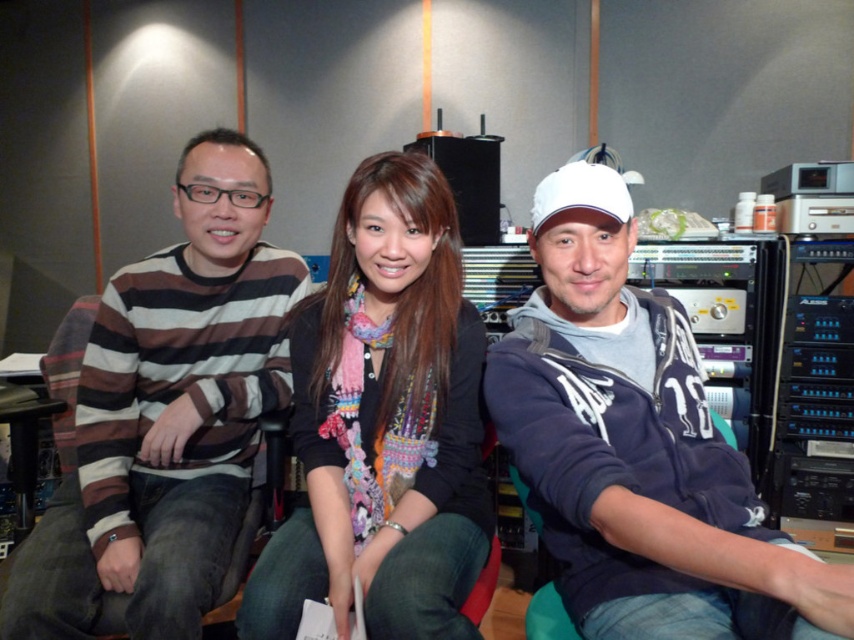
Does white matte baseball cap at upper right have a greater height compared to multicolored knitted scarf at center?

No.

Is the position of white matte baseball cap at upper right more distant than that of multicolored knitted scarf at center?

No, it is not.

This screenshot has width=854, height=640. Find the location of `white matte baseball cap at upper right`. white matte baseball cap at upper right is located at coordinates (636, 448).

Where is `white matte baseball cap at upper right`? The width and height of the screenshot is (854, 640). white matte baseball cap at upper right is located at coordinates [636, 448].

Between point (627, 621) and point (124, 362), which one is positioned behind?

Positioned behind is point (124, 362).

In the scene shown: Is white matte baseball cap at upper right taller than striped cotton sweater at left?

In fact, white matte baseball cap at upper right may be shorter than striped cotton sweater at left.

Measure the distance between white matte baseball cap at upper right and camera.

They are 63.52 centimeters apart.

Locate an element on the screen. This screenshot has width=854, height=640. white matte baseball cap at upper right is located at coordinates (636, 448).

Is point (262, 296) farther from camera compared to point (352, 246)?

Yes, it is.

Is striped cotton sweater at left shorter than multicolored knitted scarf at center?

No.

Who is more forward, (x=185, y=177) or (x=475, y=413)?

Point (x=475, y=413)

Where is `striped cotton sweater at left`? The width and height of the screenshot is (854, 640). striped cotton sweater at left is located at coordinates (167, 417).